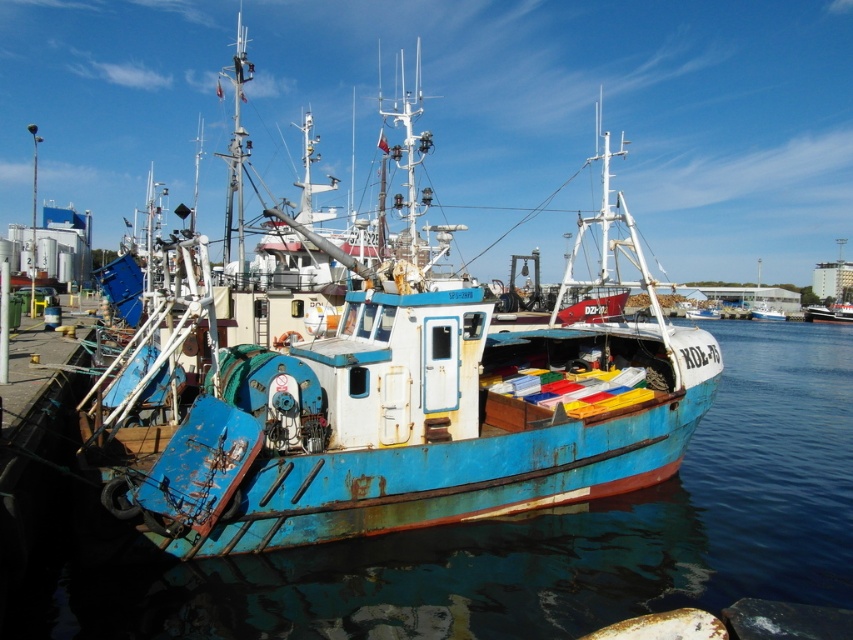
Question: Which of the following is the closest to the observer?

Choices:
 (A) rusty metal boat at center
 (B) blue metallic water at center

Answer: (B)

Question: Where is rusty metal boat at center located in relation to blue metallic water at center in the image?

Choices:
 (A) above
 (B) below

Answer: (A)

Question: Which point appears closest to the camera in this image?

Choices:
 (A) (498, 349)
 (B) (480, 582)

Answer: (B)

Question: Does rusty metal boat at center appear under blue metallic water at center?

Choices:
 (A) yes
 (B) no

Answer: (B)

Question: Does rusty metal boat at center have a larger size compared to blue metallic water at center?

Choices:
 (A) no
 (B) yes

Answer: (B)